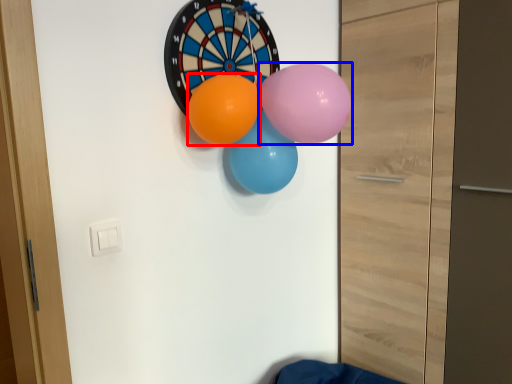
Question: Which object is further to the camera taking this photo, balloon (highlighted by a red box) or balloon (highlighted by a blue box)?

Choices:
 (A) balloon
 (B) balloon

Answer: (A)